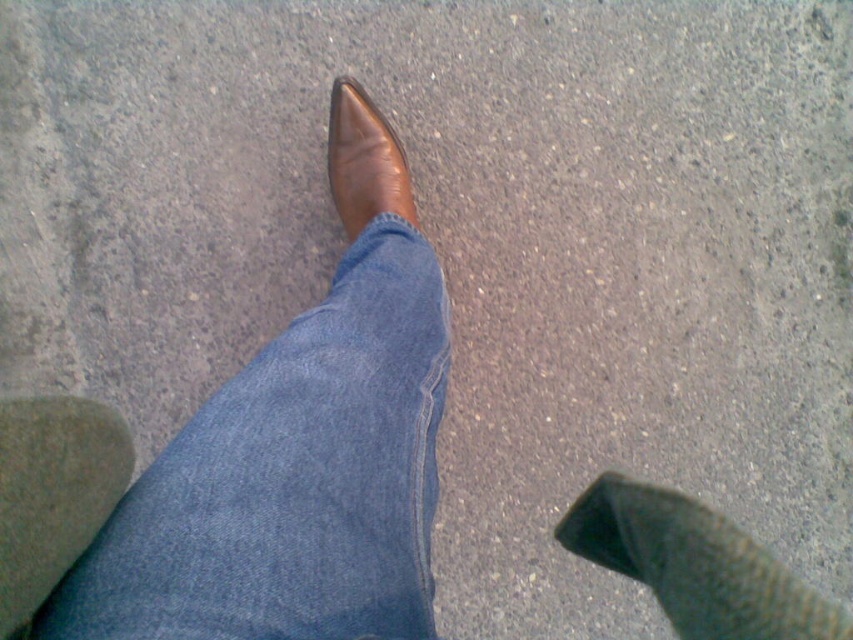
Question: Is green textured sock at lower right positioned at the back of brown leather shoe at center?

Choices:
 (A) no
 (B) yes

Answer: (A)

Question: Is green textured sock at lower right wider than green suede sock at lower left?

Choices:
 (A) no
 (B) yes

Answer: (B)

Question: Which object is the farthest from the green textured sock at lower right?

Choices:
 (A) denim at center
 (B) green suede sock at lower left
 (C) brown leather shoe at center

Answer: (B)

Question: Which point is farther from the camera taking this photo?

Choices:
 (A) (245, 548)
 (B) (347, 161)
 (C) (598, 554)
 (D) (3, 557)

Answer: (B)

Question: Is denim at center wider than green textured sock at lower right?

Choices:
 (A) yes
 (B) no

Answer: (A)

Question: Which object is farther from the camera taking this photo?

Choices:
 (A) green textured sock at lower right
 (B) denim at center
 (C) green suede sock at lower left
 (D) brown leather shoe at center

Answer: (D)